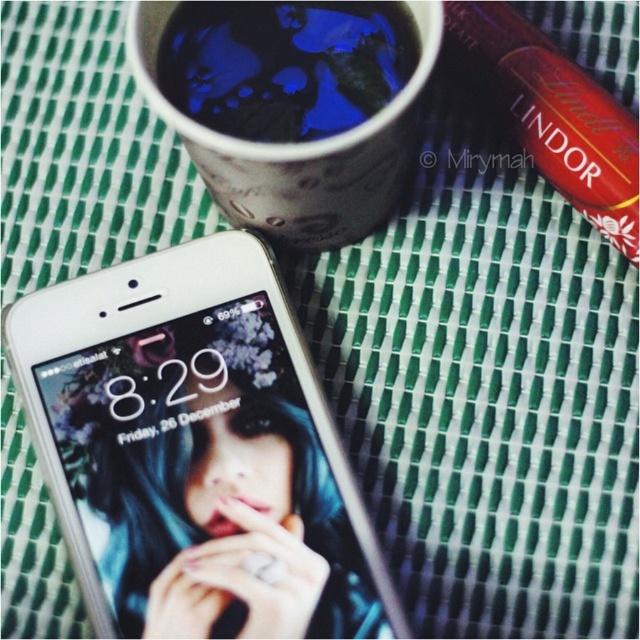
You are setting up a small table for a morning coffee break. You have a blue glossy mug at upper center and a blue matte cup at upper center. Which one is closer to you when both are placed on the table?

The blue glossy mug at upper center is closer to you because the blue matte cup at upper center is behind it.

You are setting up a small table for a morning coffee break. You have a blue glossy mug at upper center and a blue matte cup at upper center. Which one is positioned to the right side of the other?

The blue glossy mug at upper center is positioned to the right of the blue matte cup at upper center.

You are a delivery robot that needs to place a package between the silver metallic smartphone at lower left and the blue glossy mug at upper center. The package is 12 inches long. Will there be enough space between them to fit the package?

The silver metallic smartphone at lower left and the blue glossy mug at upper center are 14.30 inches apart from each other. Since the package is 12 inches long, there is enough space to fit it between them.